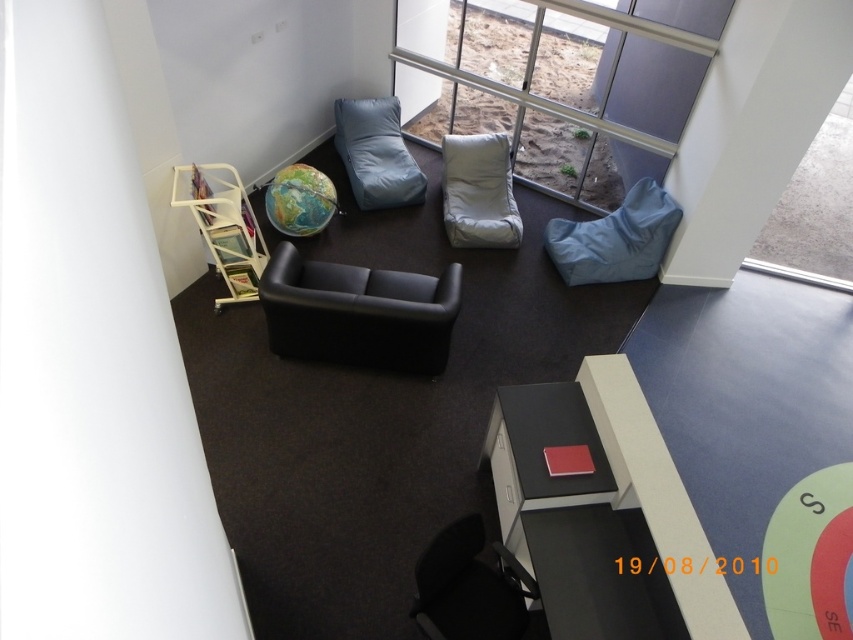
You are a delivery person trying to move a large box through the room. The box is 1.2 meters wide. You need to pass between the transparent glass window at upper right and the matte blue bean bag at right. Can you fit through the space between them?

The transparent glass window at upper right might be wider than matte blue bean bag at right, so the space between them could be sufficient for the 1.2 meter wide box. However, since the exact width isn

You are standing in the room and want to place a new plant pot at the point marked as point (814,211). Based on the scene description, where exactly would this point be located?

The point (814,211) is located on the transparent glass window at upper right.